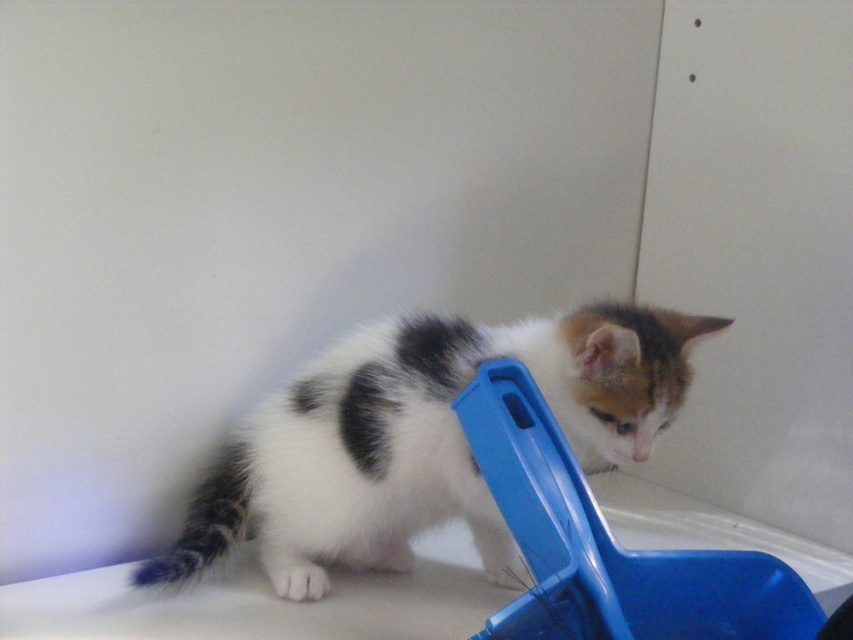
Question: Among these points, which one is farthest from the camera?

Choices:
 (A) (556, 449)
 (B) (277, 579)

Answer: (B)

Question: Which point is closer to the camera?

Choices:
 (A) click(x=543, y=588)
 (B) click(x=643, y=353)

Answer: (A)

Question: Is white fur cat at center to the left of blue plastic scoop at lower center from the viewer's perspective?

Choices:
 (A) yes
 (B) no

Answer: (A)

Question: Is white fur cat at center positioned at the back of blue plastic scoop at lower center?

Choices:
 (A) yes
 (B) no

Answer: (A)

Question: Is white fur cat at center positioned in front of blue plastic scoop at lower center?

Choices:
 (A) no
 (B) yes

Answer: (A)